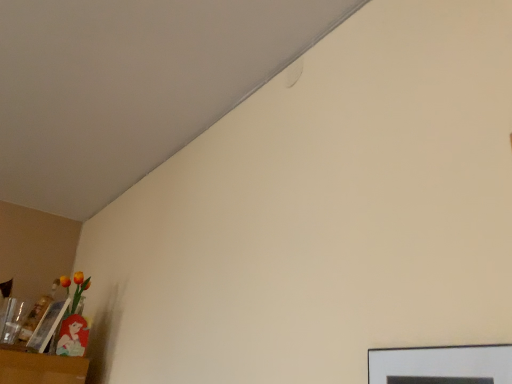
Question: From a real-world perspective, is matte black picture frame at lower right, the 1th picture frame in the top-to-bottom sequence, physically located above or below matte plastic picture frame at lower left, which is the 1th picture frame from back to front?

Choices:
 (A) above
 (B) below

Answer: (B)

Question: Considering the relative positions of matte black picture frame at lower right, which is the first picture frame from front to back, and matte plastic picture frame at lower left, acting as the first picture frame starting from the left, in the image provided, is matte black picture frame at lower right, which is the first picture frame from front to back, to the left or to the right of matte plastic picture frame at lower left, acting as the first picture frame starting from the left,?

Choices:
 (A) right
 (B) left

Answer: (A)

Question: Considering the positions of matte black picture frame at lower right, the 1th picture frame in the top-to-bottom sequence, and matte plastic picture frame at lower left, which is the 1th picture frame from back to front, in the image, is matte black picture frame at lower right, the 1th picture frame in the top-to-bottom sequence, wider or thinner than matte plastic picture frame at lower left, which is the 1th picture frame from back to front,?

Choices:
 (A) thin
 (B) wide

Answer: (A)

Question: From the image's perspective, is matte plastic picture frame at lower left, acting as the first picture frame starting from the left, above or below matte black picture frame at lower right, marked as the second picture frame in a back-to-front arrangement?

Choices:
 (A) above
 (B) below

Answer: (B)

Question: In the image, is matte plastic picture frame at lower left, which is the 1th picture frame from back to front, positioned in front of or behind matte black picture frame at lower right, marked as the second picture frame in a back-to-front arrangement?

Choices:
 (A) behind
 (B) front

Answer: (A)

Question: Considering the positions of matte plastic picture frame at lower left, which is the 1th picture frame from back to front, and matte black picture frame at lower right, which appears as the 2th picture frame when viewed from the left, in the image, is matte plastic picture frame at lower left, which is the 1th picture frame from back to front, wider or thinner than matte black picture frame at lower right, which appears as the 2th picture frame when viewed from the left,?

Choices:
 (A) wide
 (B) thin

Answer: (A)

Question: Based on their sizes in the image, would you say matte plastic picture frame at lower left, which appears as the second picture frame when viewed from the right, is bigger or smaller than matte black picture frame at lower right, which is the first picture frame from front to back?

Choices:
 (A) small
 (B) big

Answer: (B)